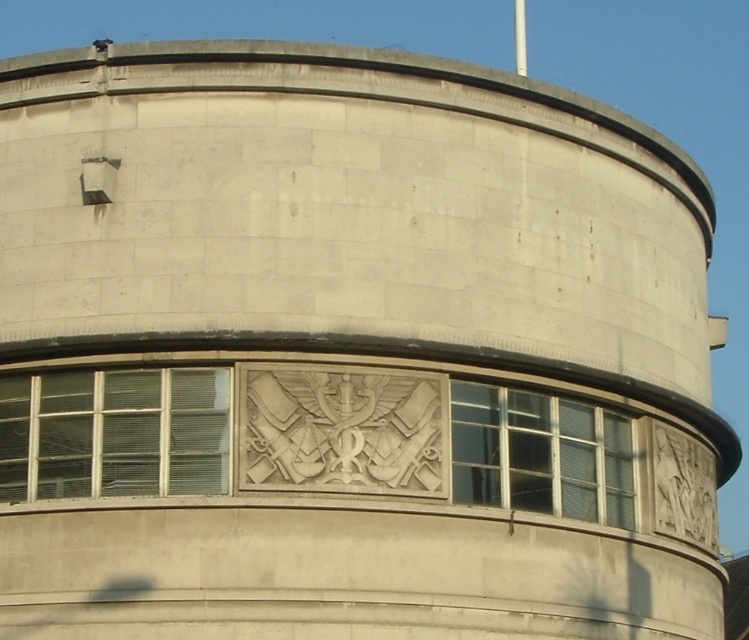
Question: Which object appears farthest from the camera in this image?

Choices:
 (A) clear glass window at center
 (B) clear glass window at lower left

Answer: (A)

Question: Which of the following is the closest to the observer?

Choices:
 (A) (454, 468)
 (B) (184, 449)

Answer: (B)

Question: Does clear glass window at lower left appear on the right side of clear glass window at center?

Choices:
 (A) no
 (B) yes

Answer: (A)

Question: Can you confirm if clear glass window at lower left is bigger than clear glass window at center?

Choices:
 (A) no
 (B) yes

Answer: (A)

Question: Is clear glass window at lower left to the right of clear glass window at center from the viewer's perspective?

Choices:
 (A) yes
 (B) no

Answer: (B)